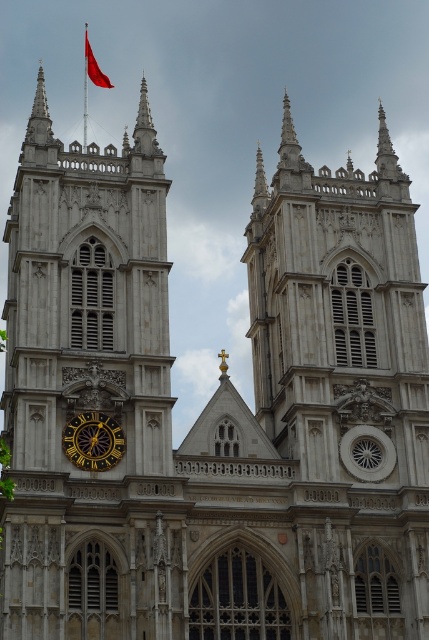
You are standing in front of Westminster Abbey and notice the gold metallic clock at lower left and the smooth red flag at upper left. Which object is taller?

The gold metallic clock at lower left is shorter than the smooth red flag at upper left, so the smooth red flag at upper left is taller.

You are standing in front of Westminster Abbey and want to take a photo of the gold metallic clock at lower left. To ensure the clock is centered in your photo, where should you position your camera relative to the Abbey?

To center the gold metallic clock at lower left in your photo, position your camera so that the clock is aligned with the center point of your viewfinder or screen, which corresponds to its 2D location at approximately point 0.689 on the x and 0.217 on the y coordinates.